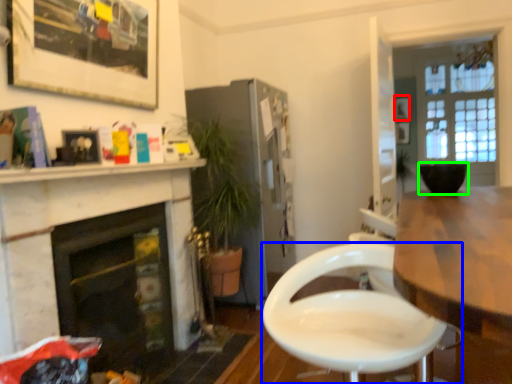
Question: Which object is the farthest from picture frame (highlighted by a red box)? Choose among these: chair (highlighted by a blue box) or flowerpot (highlighted by a green box).

Choices:
 (A) chair
 (B) flowerpot

Answer: (A)